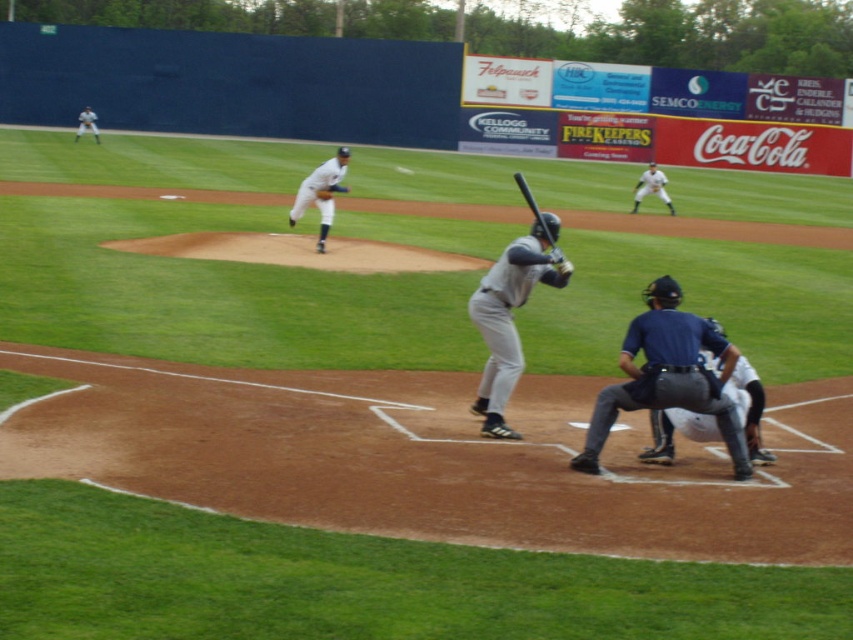
Can you confirm if white uniform at upper right is wider than white uniform at center?

No, white uniform at upper right is not wider than white uniform at center.

Who is positioned more to the right, white uniform at upper right or white uniform at center?

white uniform at upper right

Identify the location of white uniform at upper right. (651, 188).

This screenshot has height=640, width=853. Describe the element at coordinates (666, 376) in the screenshot. I see `dark blue uniform at lower right` at that location.

Where is `dark blue uniform at lower right`? The height and width of the screenshot is (640, 853). dark blue uniform at lower right is located at coordinates (x=666, y=376).

The image size is (853, 640). What do you see at coordinates (509, 316) in the screenshot? I see `gray matte uniform at center` at bounding box center [509, 316].

Is gray matte uniform at center smaller than dark blue padded uniform at lower center?

No.

This screenshot has height=640, width=853. I want to click on gray matte uniform at center, so click(509, 316).